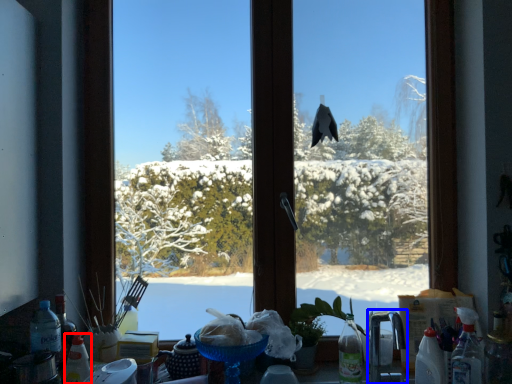
Question: Among these objects, which one is farthest to the camera, bottle (highlighted by a red box) or faucet (highlighted by a blue box)?

Choices:
 (A) bottle
 (B) faucet

Answer: (A)